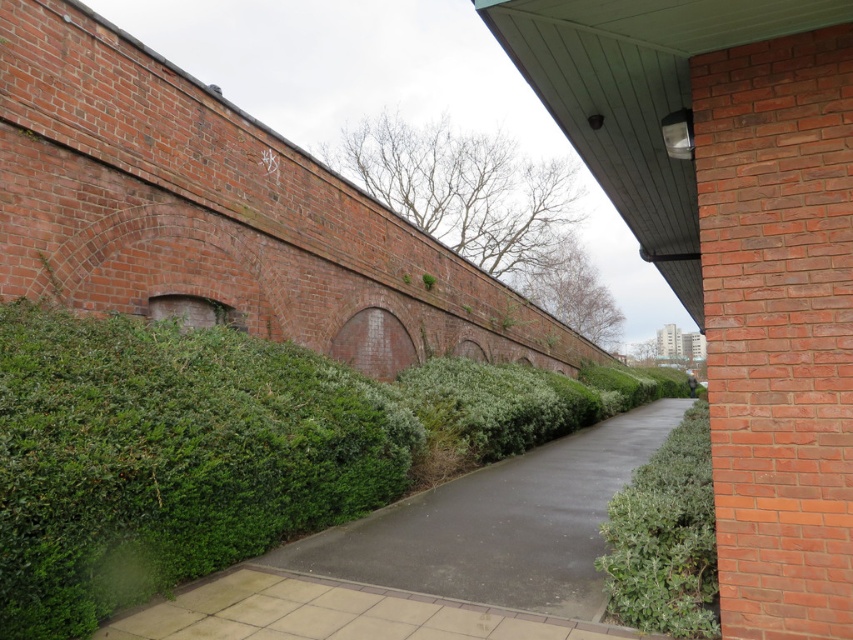
You are a gardener planning to mow the green asphalt pavement at center and trim the green leafy hedge at right. Since you can only work on one at a time, which area should you tackle first if you want to handle the wider one first?

The green asphalt pavement at center is wider than the green leafy hedge at right, so you should mow the green asphalt pavement at center first.

You are a gardener standing on the green asphalt pavement at center, and you need to water the green leafy hedge at right. Your watering can holds enough water for 10 feet of travel. Can you reach the hedge without refilling?

The green asphalt pavement at center is 16.89 feet away from the green leafy hedge at right. Since the watering can only allows 10 feet of travel, you cannot reach the hedge without refilling.

You are standing on the green asphalt pavement at center and want to walk towards the green leafy hedge at right. Which direction should you move to reach it?

To reach the green leafy hedge at right from the green asphalt pavement at center, you should move towards the right since the hedge is positioned to the right side of the pavement.